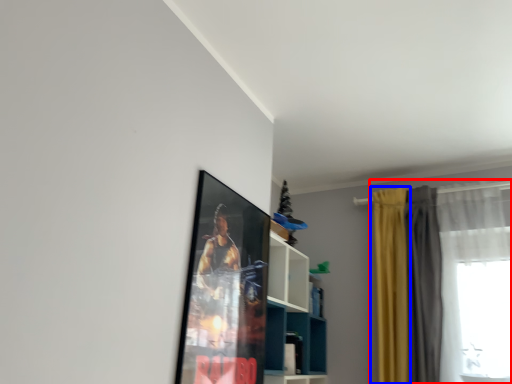
Question: Which object appears closest to the camera in this image, curtain (highlighted by a red box) or curtain (highlighted by a blue box)?

Choices:
 (A) curtain
 (B) curtain

Answer: (A)